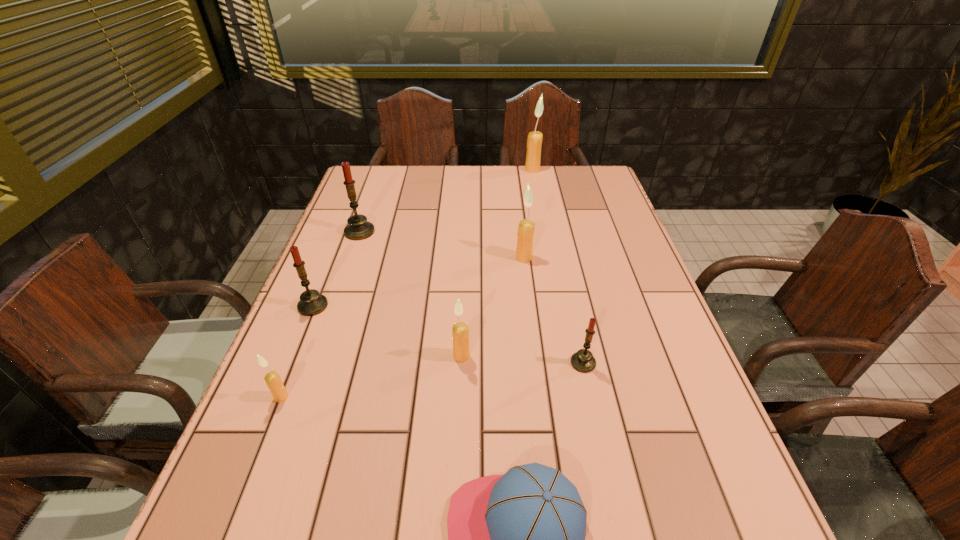
The width and height of the screenshot is (960, 540). I want to click on free space that is in between the seventh nearest object and the rightmost red candle, so click(x=471, y=297).

Locate an element on the screen. free spot between the farthest candle and the nearest cream candle is located at coordinates (407, 284).

This screenshot has height=540, width=960. Find the location of `empty space between the second farthest candle and the smallest cream candle`. empty space between the second farthest candle and the smallest cream candle is located at coordinates (321, 314).

This screenshot has width=960, height=540. Identify the location of the closest object to the shortest object. (583, 361).

Identify the location of object that stands as the closest to the second biggest red candle. (272, 379).

Locate which candle is the closest to the second nearest cream candle. Please provide its 2D coordinates. Your answer should be formatted as a tuple, i.e. [(x, y)], where the tuple contains the x and y coordinates of a point satisfying the conditions above.

[(583, 361)]

Image resolution: width=960 pixels, height=540 pixels. I want to click on candle that is the third closest one to the shortest object, so click(x=272, y=379).

Point out which cream candle is positioned as the second nearest to the nearest red candle. Please provide its 2D coordinates. Your answer should be formatted as a tuple, i.e. [(x, y)], where the tuple contains the x and y coordinates of a point satisfying the conditions above.

[(525, 233)]

At what (x,y) coordinates should I click in order to perform the action: click on cream candle that stands as the third closest to the third farthest object. Please return your answer as a coordinate pair (x, y). This screenshot has height=540, width=960. Looking at the image, I should click on (272, 379).

Locate an element on the screen. The image size is (960, 540). red candle that stands as the second closest to the second cream candle from left to right is located at coordinates tap(311, 303).